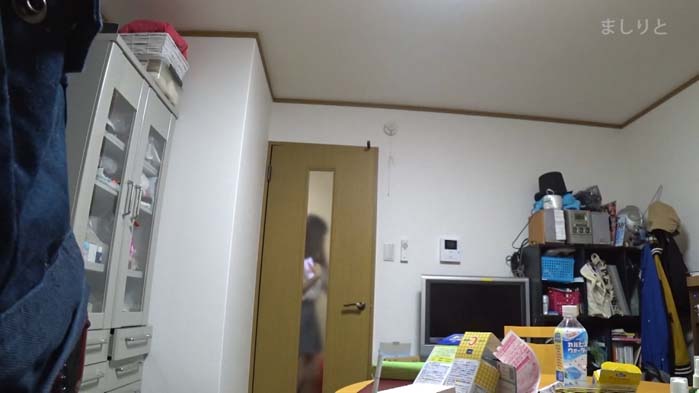
The image size is (699, 393). Find the location of `corner`. corner is located at coordinates (626, 164).